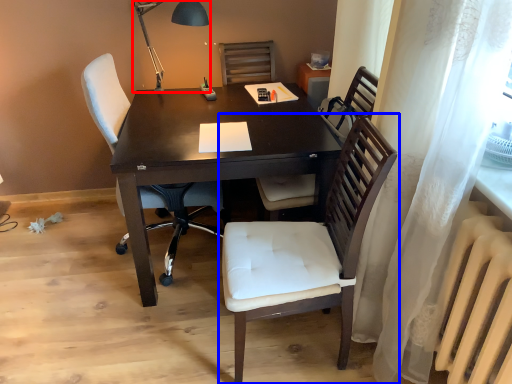
Question: Among these objects, which one is farthest to the camera, table lamp (highlighted by a red box) or chair (highlighted by a blue box)?

Choices:
 (A) table lamp
 (B) chair

Answer: (A)